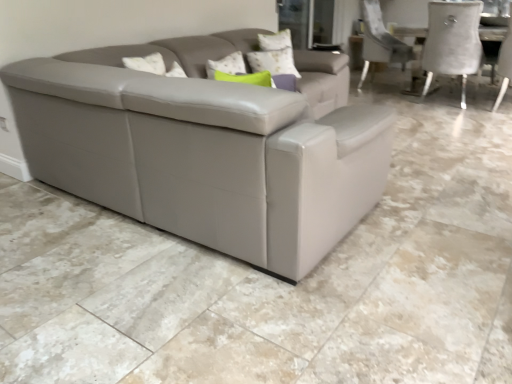
The width and height of the screenshot is (512, 384). Find the location of `free space to the back side of white fabric chair at right`. free space to the back side of white fabric chair at right is located at coordinates (472, 99).